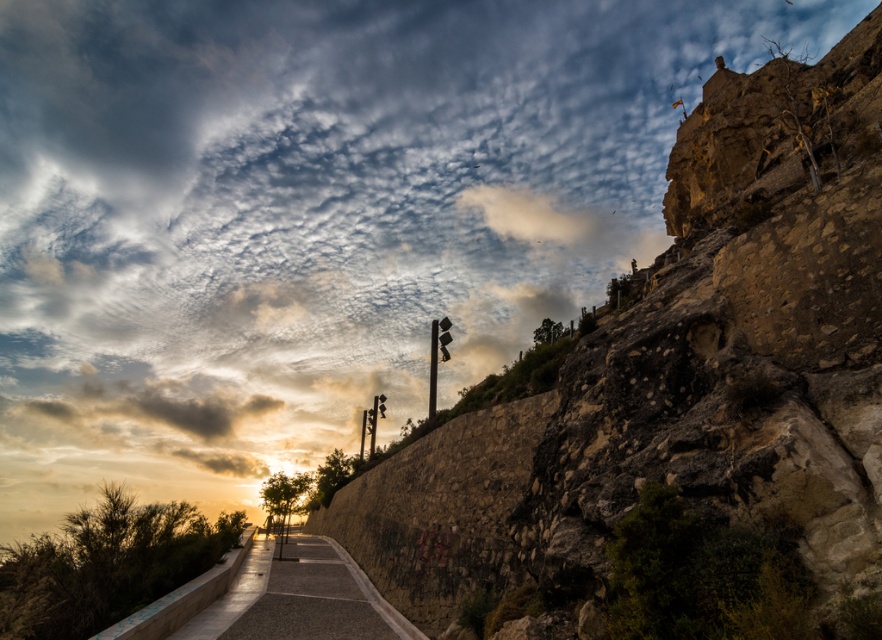
In the scene shown: Is rustic stone wall at center taller than smooth concrete path at center?

Yes.

Is rustic stone wall at center to the left of smooth concrete path at center from the viewer's perspective?

No, rustic stone wall at center is not to the left of smooth concrete path at center.

Identify the location of rustic stone wall at center. This screenshot has width=882, height=640. (677, 380).